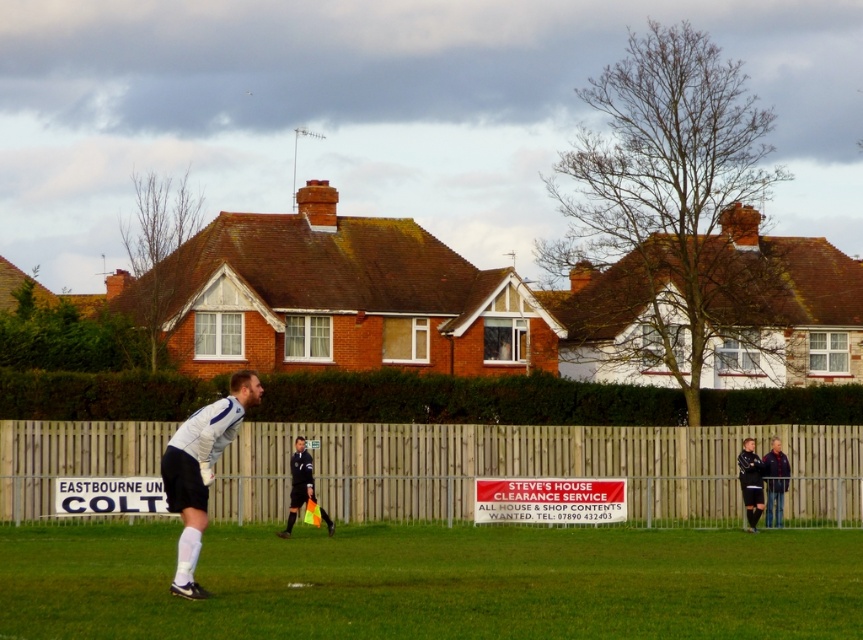
Which is more to the right, white matte jersey at center or black jersey at right?

From the viewer's perspective, black jersey at right appears more on the right side.

Is white matte jersey at center to the right of black jersey at right from the viewer's perspective?

No, white matte jersey at center is not to the right of black jersey at right.

You are a GUI agent. You are given a task and a screenshot of the screen. Output one action in this format:
    pyautogui.click(x=<x>, y=<y>)
    Task: Click on the white matte jersey at center
    This screenshot has width=863, height=640.
    Given the screenshot: What is the action you would take?
    pyautogui.click(x=200, y=470)

Between white matte jersey at center and neon yellow fabric flag at center, which one has more height?

white matte jersey at center

Which is behind, point (205, 512) or point (309, 477)?

The point (309, 477) is more distant.

Which is behind, point (209, 442) or point (293, 502)?

The point (293, 502) is behind.

You are a GUI agent. You are given a task and a screenshot of the screen. Output one action in this format:
    pyautogui.click(x=<x>, y=<y>)
    Task: Click on the white matte jersey at center
    
    Given the screenshot: What is the action you would take?
    pyautogui.click(x=200, y=470)

Who is positioned more to the left, wooden fence at center or dark blue jersey at center?

wooden fence at center

Which is above, wooden fence at center or dark blue jersey at center?

A: wooden fence at center is higher up.

Is point (728, 435) positioned after point (775, 445)?

Yes.

At what (x,y) coordinates should I click in order to perform the action: click on wooden fence at center. Please return your answer as a coordinate pair (x, y). The width and height of the screenshot is (863, 640). Looking at the image, I should click on (534, 468).